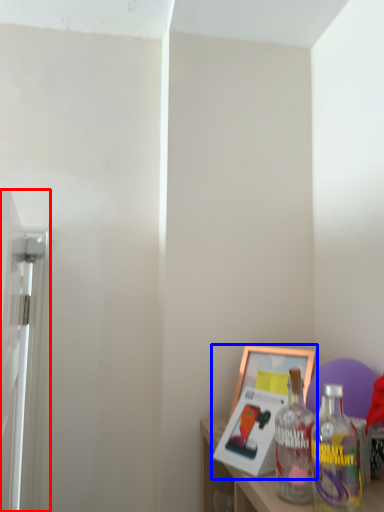
Question: Which object is further to the camera taking this photo, screen door (highlighted by a red box) or picture frame (highlighted by a blue box)?

Choices:
 (A) screen door
 (B) picture frame

Answer: (B)